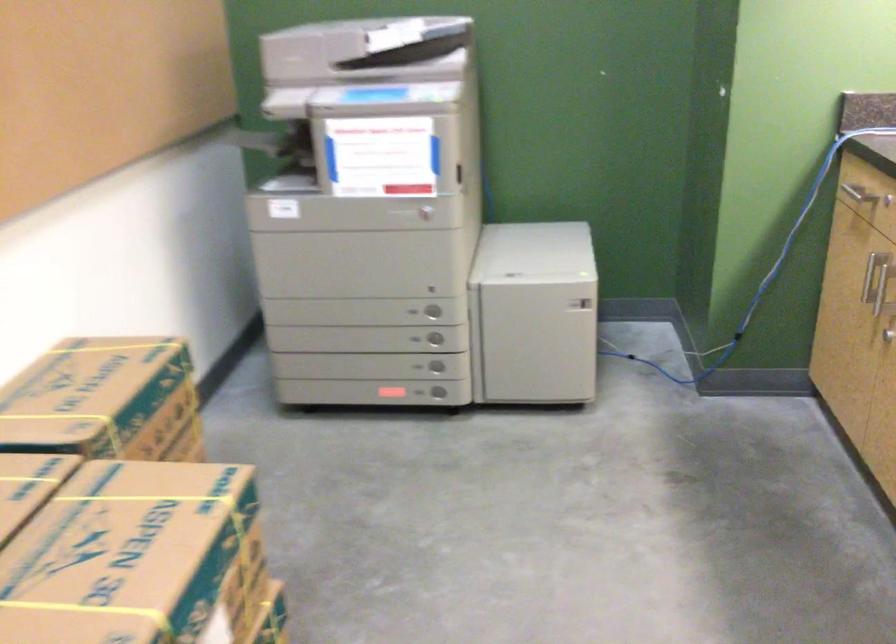
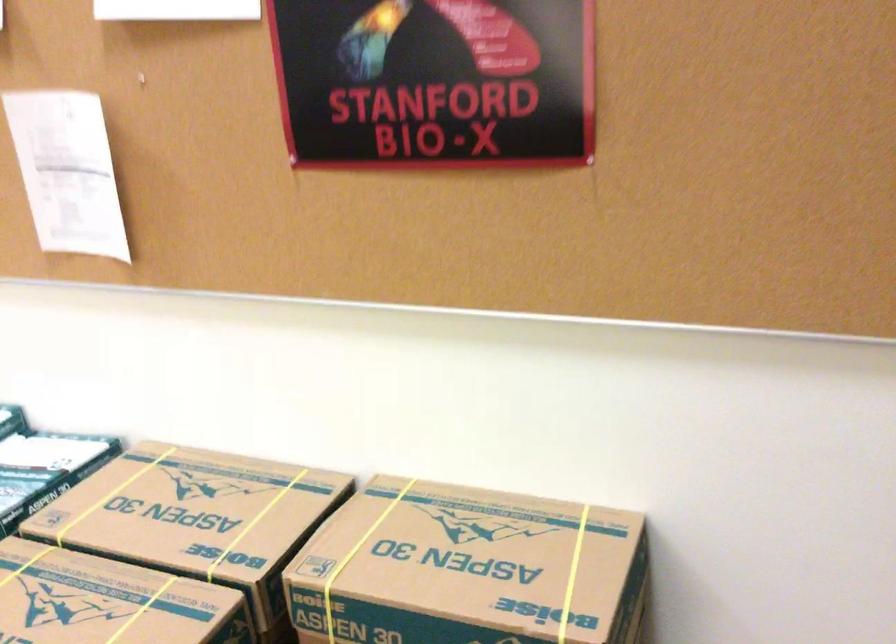
Locate, in the second image, the point that corresponds to [85,411] in the first image.

(357, 556)